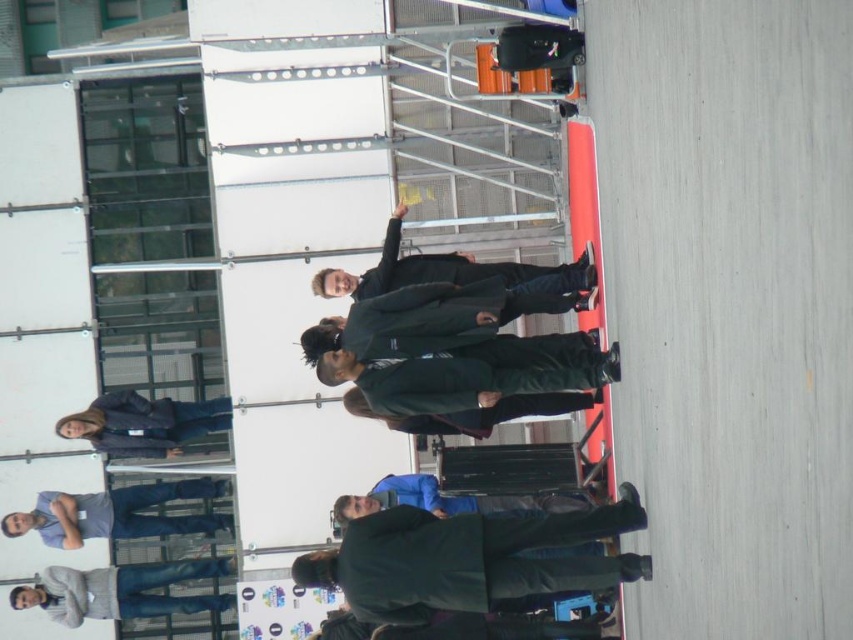
Between dark blue jacket at lower left and dark green fabric jacket at center, which one has more height?

dark blue jacket at lower left is taller.

Who is shorter, dark blue jacket at lower left or dark green fabric jacket at center?

dark green fabric jacket at center is shorter.

You are a GUI agent. You are given a task and a screenshot of the screen. Output one action in this format:
    pyautogui.click(x=<x>, y=<y>)
    Task: Click on the dark blue jacket at lower left
    Image resolution: width=853 pixels, height=640 pixels.
    Given the screenshot: What is the action you would take?
    pyautogui.click(x=143, y=422)

Is green matte jacket at center to the right of dark blue jacket at lower left from the viewer's perspective?

Correct, you'll find green matte jacket at center to the right of dark blue jacket at lower left.

Between green matte jacket at center and dark blue jacket at lower left, which one has less height?

green matte jacket at center is shorter.

Is point (604, 384) farther from viewer compared to point (161, 451)?

That is False.

This screenshot has width=853, height=640. I want to click on green matte jacket at center, so click(x=476, y=372).

Which is more to the left, dark green fabric business suit at center or green matte jacket at center?

dark green fabric business suit at center

Which is behind, point (350, 529) or point (392, 397)?

The point (392, 397) is behind.

Who is more distant from viewer, [471,595] or [416,368]?

The point [416,368] is more distant.

Identify the location of dark green fabric business suit at center. The image size is (853, 640). (471, 557).